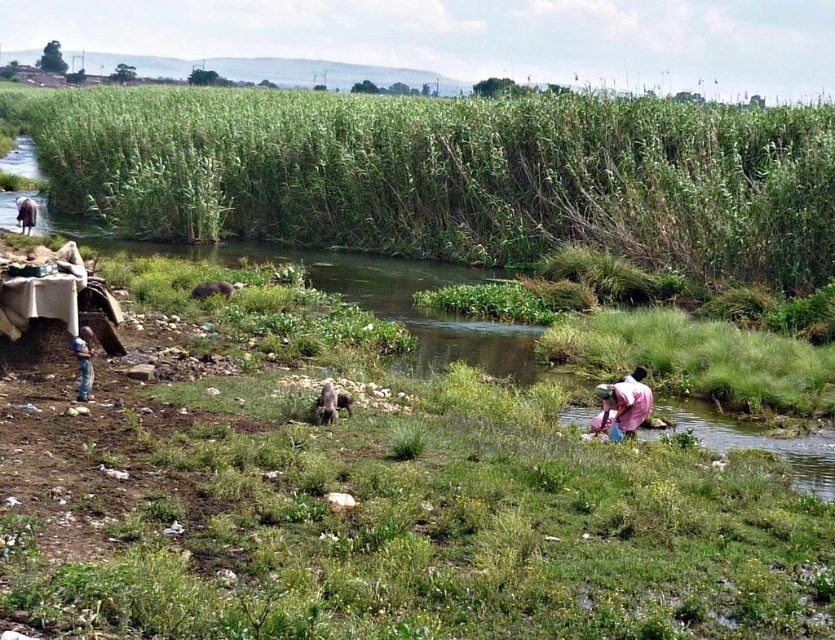
Does green grassy river at center appear on the right side of light brown fabric at lower left?

In fact, green grassy river at center is to the left of light brown fabric at lower left.

Is green grassy river at center shorter than light brown fabric at lower left?

In fact, green grassy river at center may be taller than light brown fabric at lower left.

Who is more forward, (185,252) or (28,216)?

Point (28,216)

Where is `green grassy river at center`? Image resolution: width=835 pixels, height=640 pixels. green grassy river at center is located at coordinates (367, 296).

Between green grassy reed at upper left and pink fabric at lower right, which one appears on the right side from the viewer's perspective?

Positioned to the right is pink fabric at lower right.

Can you confirm if green grassy reed at upper left is taller than pink fabric at lower right?

Yes, green grassy reed at upper left is taller than pink fabric at lower right.

Is point (636, 259) positioned after point (618, 397)?

Yes, point (636, 259) is behind point (618, 397).

Identify the location of green grassy reed at upper left. (453, 173).

In the scene shown: Can you confirm if green grassy river at center is positioned to the right of blue fabric bag at left?

In fact, green grassy river at center is to the left of blue fabric bag at left.

Who is more forward, (x=433, y=317) or (x=79, y=388)?

Point (x=79, y=388) is in front.

At what (x,y) coordinates should I click in order to perform the action: click on green grassy river at center. Please return your answer as a coordinate pair (x, y). Looking at the image, I should click on [x=367, y=296].